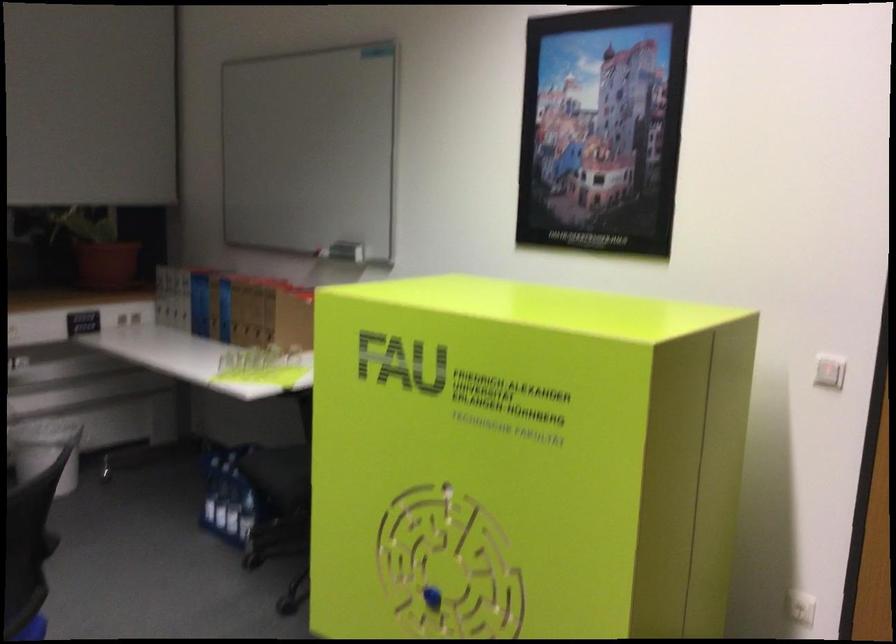
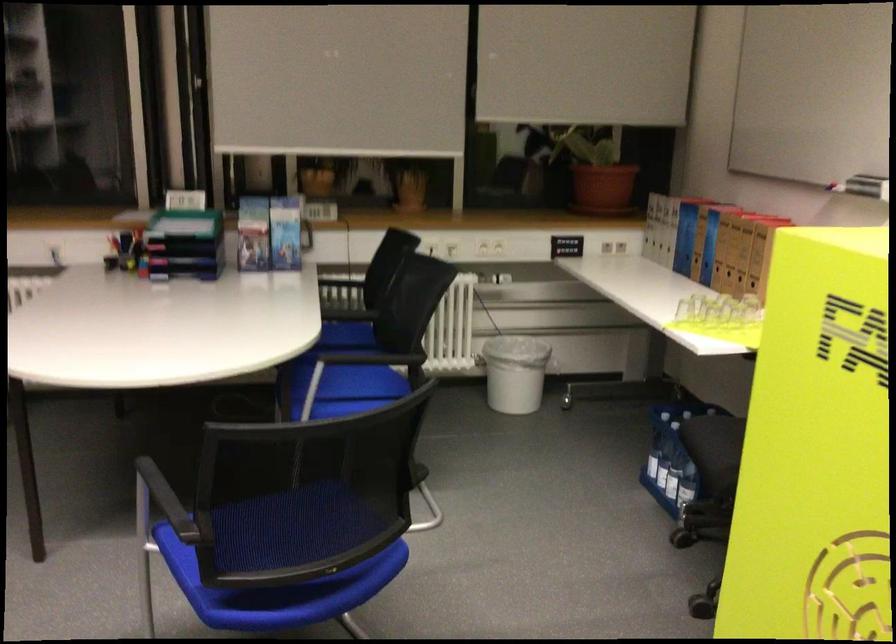
Find the pixel in the second image that matches pixel 202 306 in the first image.

(685, 238)